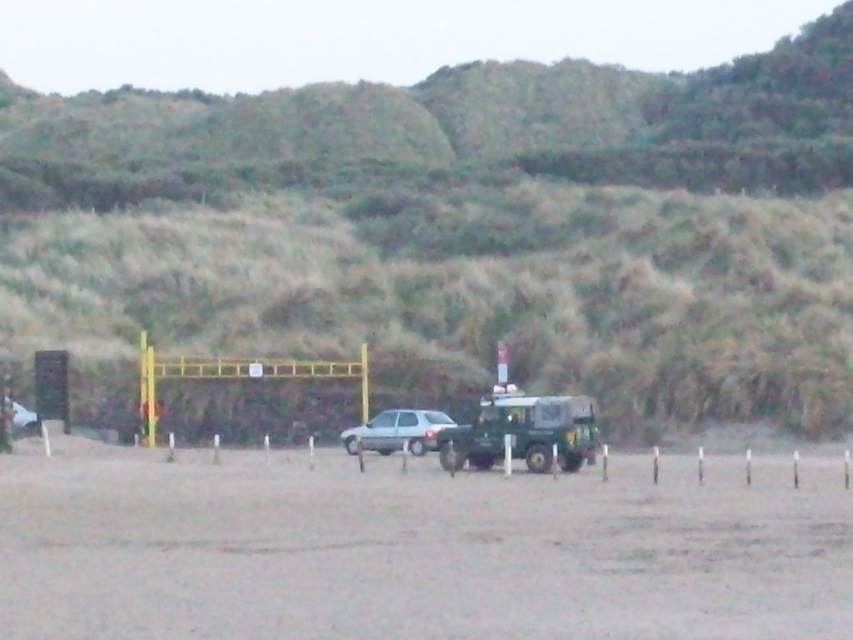
Question: Which object is positioned farthest from the green grassy hillside at upper center?

Choices:
 (A) green matte jeep at center
 (B) satin silver car at center
 (C) gray sand at center

Answer: (B)

Question: Does gray sand at center have a lesser width compared to green matte jeep at center?

Choices:
 (A) no
 (B) yes

Answer: (A)

Question: Is the position of green grassy hillside at upper center more distant than that of gray sand at center?

Choices:
 (A) yes
 (B) no

Answer: (A)

Question: Is gray sand at center to the left of satin silver car at center from the viewer's perspective?

Choices:
 (A) yes
 (B) no

Answer: (B)

Question: Which is nearer to the green matte jeep at center?

Choices:
 (A) green grassy hillside at upper center
 (B) gray sand at center
 (C) satin silver car at center

Answer: (B)

Question: Among these points, which one is nearest to the camera?

Choices:
 (A) (54, 570)
 (B) (416, 424)
 (C) (583, 442)
 (D) (59, 106)

Answer: (A)